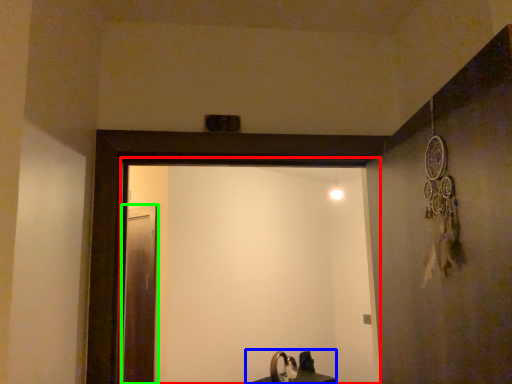
Question: Which object is positioned closest to screen door (highlighted by a red box)? Select from sink (highlighted by a blue box) and screen door (highlighted by a green box).

Choices:
 (A) sink
 (B) screen door

Answer: (A)